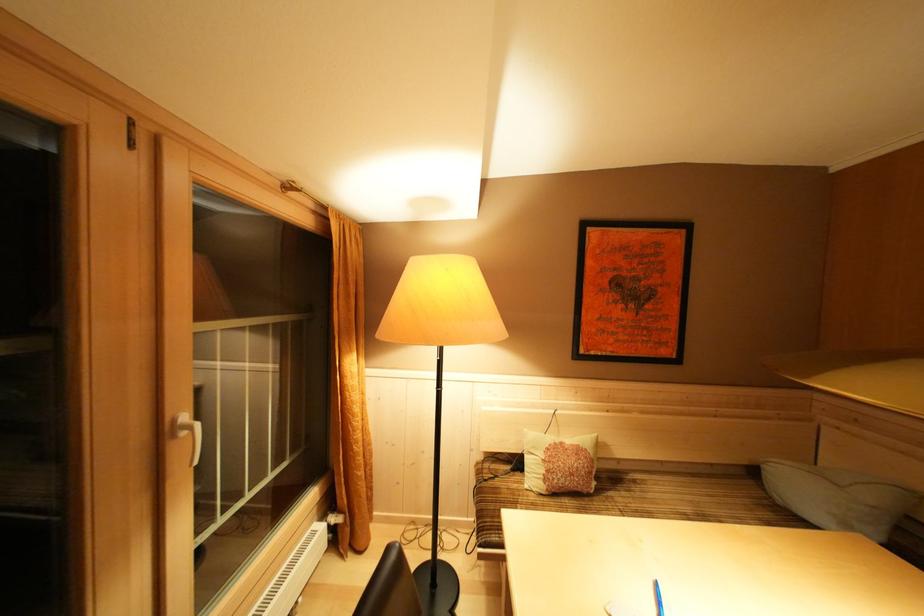
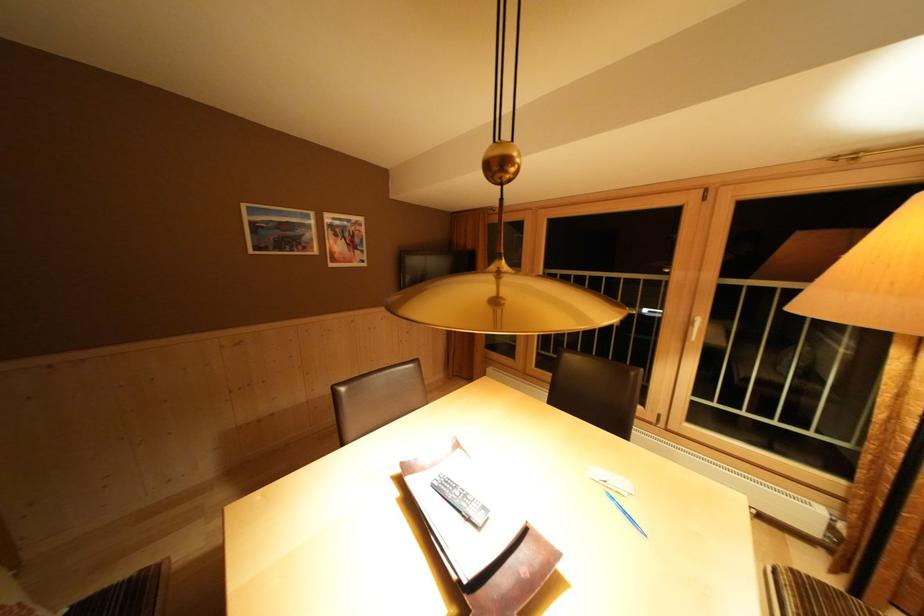
Locate, in the second image, the point that corresponds to point (169, 440) in the first image.

(697, 328)